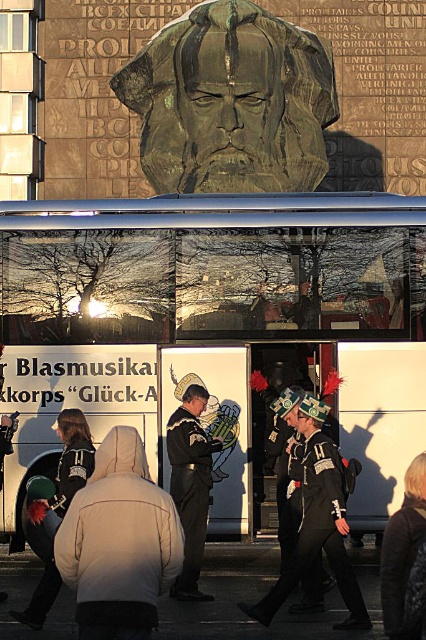
Does point (167, 228) come in front of point (46, 602)?

No, it is behind (46, 602).

Who is positioned more to the left, white glossy bus at center or brushed metal helmet at lower left?

Positioned to the left is brushed metal helmet at lower left.

Which is in front, point (244, 358) or point (77, 484)?

Positioned in front is point (77, 484).

Identify the location of white glossy bus at center. The width and height of the screenshot is (426, 640). (213, 326).

Which is above, white matte jacket at lower left or black leather uniform at center?

Positioned higher is white matte jacket at lower left.

Is point (97, 547) positioned after point (184, 493)?

No, it is in front of (184, 493).

Locate an element on the screen. Image resolution: width=426 pixels, height=640 pixels. white matte jacket at lower left is located at coordinates tap(118, 541).

Does bronze relief at upper center have a lesser height compared to black matte uniform at center?

No, bronze relief at upper center is not shorter than black matte uniform at center.

Does bronze relief at upper center have a lesser width compared to black matte uniform at center?

Incorrect, bronze relief at upper center's width is not less than black matte uniform at center's.

Is point (192, 145) farther from camera compared to point (333, 541)?

Yes, point (192, 145) is behind point (333, 541).

At what (x,y) coordinates should I click in order to perform the action: click on bronze relief at upper center. Please return your answer as a coordinate pair (x, y). The image size is (426, 640). Looking at the image, I should click on (230, 100).